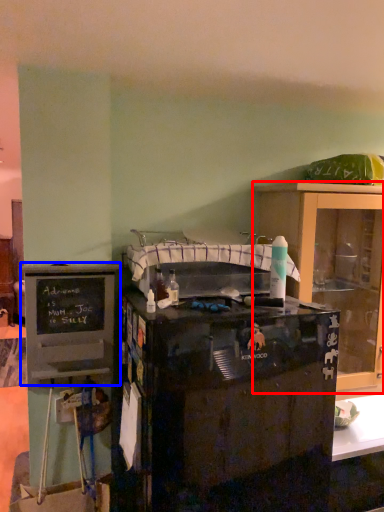
Question: Among these objects, which one is farthest to the camera, cabinetry (highlighted by a red box) or cabinetry (highlighted by a blue box)?

Choices:
 (A) cabinetry
 (B) cabinetry

Answer: (A)